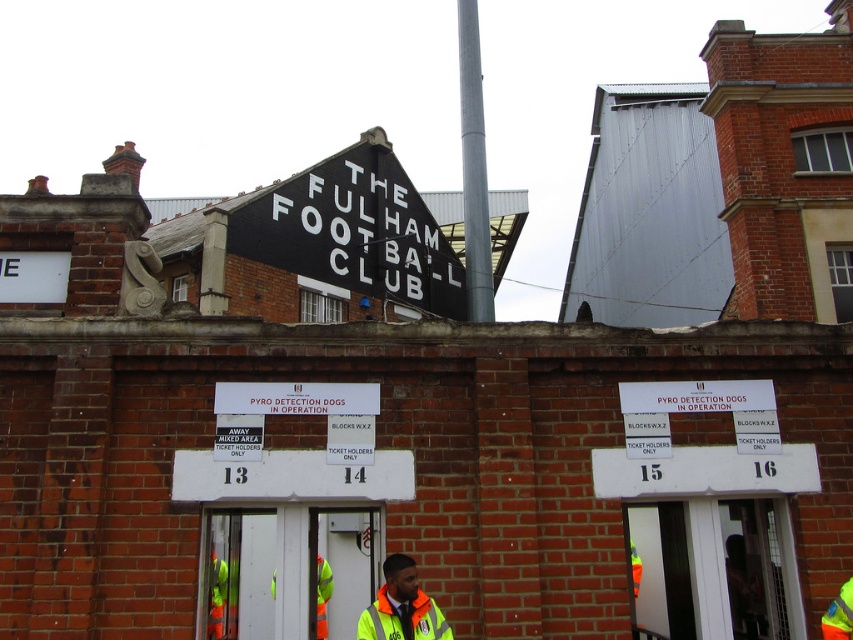
Question: Among these objects, which one is nearest to the camera?

Choices:
 (A) high visibility jacket at center
 (B) black painted signboard at upper center

Answer: (A)

Question: Is black painted signboard at upper center bigger than high visibility jacket at center?

Choices:
 (A) yes
 (B) no

Answer: (A)

Question: Among these objects, which one is nearest to the camera?

Choices:
 (A) high visibility jacket at center
 (B) silver metallic pole at center
 (C) black painted signboard at upper center

Answer: (A)

Question: Does black painted signboard at upper center have a smaller size compared to high visibility jacket at center?

Choices:
 (A) no
 (B) yes

Answer: (A)

Question: Is the position of black painted signboard at upper center less distant than that of silver metallic pole at center?

Choices:
 (A) yes
 (B) no

Answer: (B)

Question: Which point is farther from the camera taking this photo?

Choices:
 (A) (364, 637)
 (B) (397, 163)
 (C) (467, 168)

Answer: (B)